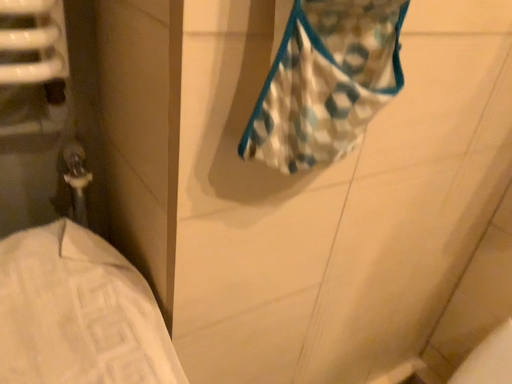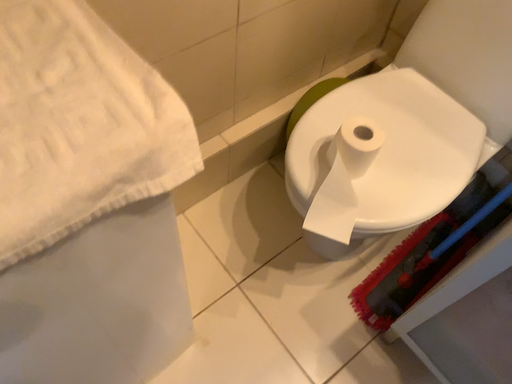
Question: Which way did the camera rotate in the video?

Choices:
 (A) rotated downward
 (B) rotated upward

Answer: (A)